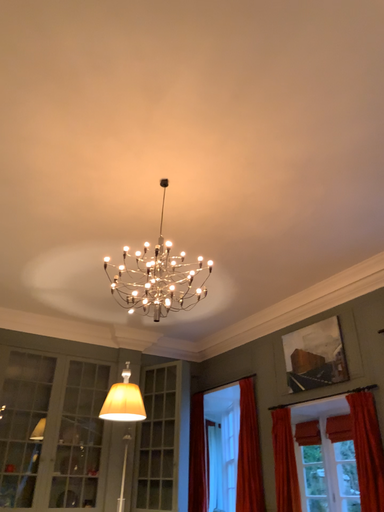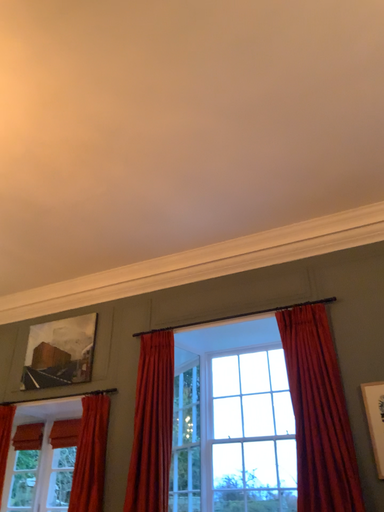
Question: Which way did the camera rotate in the video?

Choices:
 (A) rotated left
 (B) rotated right

Answer: (B)